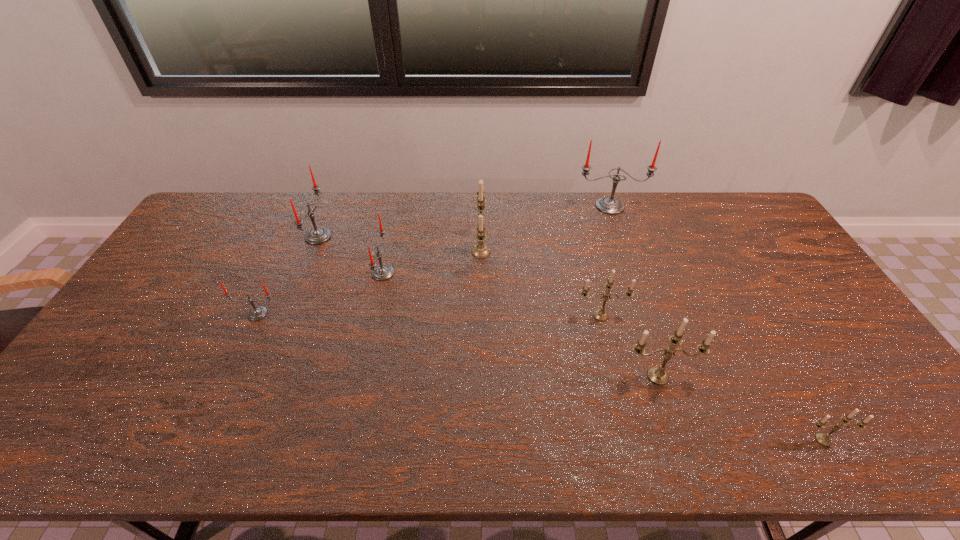
Locate an element on the screen. This screenshot has height=540, width=960. the farthest candle is located at coordinates (609, 205).

Find the location of `the rightmost red candle`. the rightmost red candle is located at coordinates (609, 205).

This screenshot has width=960, height=540. What are the coordinates of `the leftmost metallic candle` in the screenshot? It's located at (480, 250).

Where is `the farthest metallic candle`? The height and width of the screenshot is (540, 960). the farthest metallic candle is located at coordinates (480, 250).

This screenshot has height=540, width=960. In order to click on the second biggest red candle in this screenshot , I will do `click(318, 235)`.

This screenshot has width=960, height=540. Identify the location of the third smallest metallic candle. (657, 375).

The image size is (960, 540). Identify the location of the third farthest metallic candle. click(657, 375).

Image resolution: width=960 pixels, height=540 pixels. I want to click on the third candle from left to right, so click(x=381, y=272).

Identify the location of the second smallest red candle. (381, 272).

At what (x,y) coordinates should I click in order to perform the action: click on the second farthest metallic candle. Please return your answer as a coordinate pair (x, y). Looking at the image, I should click on (600, 314).